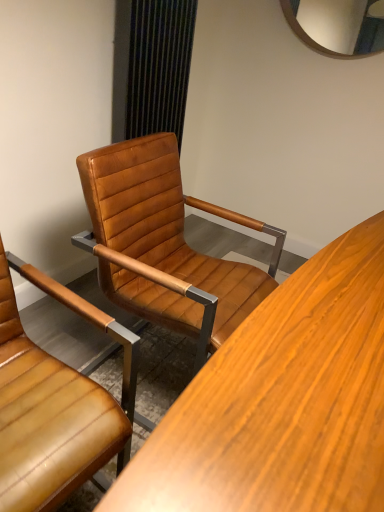
In order to face leather at center, the second chair in the right-to-left sequence, should I rotate leftwards or rightwards?

Turn left by 23.355 degrees to look at leather at center, the second chair in the right-to-left sequence.

Locate an element on the screen. The image size is (384, 512). leather at center, the first chair from the left is located at coordinates pyautogui.click(x=55, y=404).

From the image's perspective, is black textured curtain at upper center located above or below leather at center, the second chair in the right-to-left sequence?

Based on their image positions, black textured curtain at upper center is located above leather at center, the second chair in the right-to-left sequence.

Between point (137, 13) and point (4, 397), which one is positioned behind?

Point (137, 13)

From a real-world perspective, is black textured curtain at upper center on top of leather at center, the first chair from the left?

Indeed, from a real-world perspective, black textured curtain at upper center stands above leather at center, the first chair from the left.

Who is bigger, black textured curtain at upper center or leather at center, the second chair in the right-to-left sequence?

With larger size is leather at center, the second chair in the right-to-left sequence.

From a real-world perspective, does black textured curtain at upper center stand above leather at center, which ranks as the 1th chair in right-to-left order?

Yes.

Considering the relative sizes of black textured curtain at upper center and leather at center, which ranks as the 1th chair in right-to-left order, in the image provided, is black textured curtain at upper center smaller than leather at center, which ranks as the 1th chair in right-to-left order,?

Yes.

Is black textured curtain at upper center looking in the opposite direction of leather at center, which ranks as the 1th chair in right-to-left order?

black textured curtain at upper center does not have its back to leather at center, which ranks as the 1th chair in right-to-left order.

Is black textured curtain at upper center completely or partially outside of leather at center, which ranks as the 1th chair in right-to-left order?

Yes, black textured curtain at upper center is located beyond the bounds of leather at center, which ranks as the 1th chair in right-to-left order.

Considering the sizes of objects leather at center, which ranks as the 1th chair in right-to-left order, and leather at center, the first chair from the left, in the image provided, who is shorter, leather at center, which ranks as the 1th chair in right-to-left order, or leather at center, the first chair from the left,?

With less height is leather at center, the first chair from the left.

Is leather at center, which ranks as the 1th chair in right-to-left order, smaller than leather at center, the second chair in the right-to-left sequence?

No, leather at center, which ranks as the 1th chair in right-to-left order, is not smaller than leather at center, the second chair in the right-to-left sequence.

From the image's perspective, does leather at center, which ranks as the 1th chair in right-to-left order, appear lower than leather at center, the first chair from the left?

No, from the image's perspective, leather at center, which ranks as the 1th chair in right-to-left order, is not below leather at center, the first chair from the left.

Considering the sizes of leather at center, the second chair in the right-to-left sequence, and leather at center, which ranks as the second chair in left-to-right order, in the image, is leather at center, the second chair in the right-to-left sequence, wider or thinner than leather at center, which ranks as the second chair in left-to-right order,?

Considering their sizes, leather at center, the second chair in the right-to-left sequence, looks slimmer than leather at center, which ranks as the second chair in left-to-right order.

Would you consider leather at center, the first chair from the left, to be distant from leather at center, which ranks as the 1th chair in right-to-left order?

leather at center, the first chair from the left, is near leather at center, which ranks as the 1th chair in right-to-left order, not far away.

Does leather at center, the first chair from the left, have a larger size compared to leather at center, which ranks as the 1th chair in right-to-left order?

No.

How many degrees apart are the facing directions of leather at center, the second chair in the right-to-left sequence, and leather at center, which ranks as the second chair in left-to-right order?

leather at center, the second chair in the right-to-left sequence, and leather at center, which ranks as the second chair in left-to-right order, are facing 4.02 degrees away from each other.

Considering the relative sizes of leather at center, the first chair from the left, and black textured curtain at upper center in the image provided, is leather at center, the first chair from the left, smaller than black textured curtain at upper center?

Actually, leather at center, the first chair from the left, might be larger than black textured curtain at upper center.

Can you confirm if leather at center, the second chair in the right-to-left sequence, is taller than black textured curtain at upper center?

In fact, leather at center, the second chair in the right-to-left sequence, may be shorter than black textured curtain at upper center.

Is black textured curtain at upper center located within leather at center, the second chair in the right-to-left sequence?

No, black textured curtain at upper center is located outside of leather at center, the second chair in the right-to-left sequence.

Is leather at center, which ranks as the 1th chair in right-to-left order, spatially inside black textured curtain at upper center, or outside of it?

leather at center, which ranks as the 1th chair in right-to-left order, is located beyond the bounds of black textured curtain at upper center.

What's the angular difference between leather at center, which ranks as the 1th chair in right-to-left order, and black textured curtain at upper center's facing directions?

The angular difference between leather at center, which ranks as the 1th chair in right-to-left order, and black textured curtain at upper center is 0.741 degrees.

Measure the distance between leather at center, which ranks as the second chair in left-to-right order, and black textured curtain at upper center.

They are 72.08 centimeters apart.

Where is `curtain on the left of the leather at center, which ranks as the second chair in left-to-right order`? Image resolution: width=384 pixels, height=512 pixels. curtain on the left of the leather at center, which ranks as the second chair in left-to-right order is located at coordinates (158, 66).

At what (x,y) coordinates should I click in order to perform the action: click on curtain above the leather at center, the second chair in the right-to-left sequence (from a real-world perspective). Please return your answer as a coordinate pair (x, y). This screenshot has height=512, width=384. Looking at the image, I should click on (158, 66).

The height and width of the screenshot is (512, 384). I want to click on curtain on the left side of leather at center, which ranks as the second chair in left-to-right order, so click(x=158, y=66).

Looking at this image, based on their spatial positions, is leather at center, which ranks as the 1th chair in right-to-left order, or leather at center, the first chair from the left, closer to black textured curtain at upper center?

leather at center, which ranks as the 1th chair in right-to-left order.

When comparing their distances from black textured curtain at upper center, does leather at center, the first chair from the left, or leather at center, which ranks as the second chair in left-to-right order, seem closer?

leather at center, which ranks as the second chair in left-to-right order.

Looking at the image, which one is located further to leather at center, the first chair from the left, leather at center, which ranks as the second chair in left-to-right order, or black textured curtain at upper center?

black textured curtain at upper center is further to leather at center, the first chair from the left.

Estimate the real-world distances between objects in this image. Which object is further from leather at center, the second chair in the right-to-left sequence, black textured curtain at upper center or leather at center, which ranks as the 1th chair in right-to-left order?

Based on the image, black textured curtain at upper center appears to be further to leather at center, the second chair in the right-to-left sequence.

Looking at this image, which object lies nearer to the anchor point leather at center, which ranks as the second chair in left-to-right order, leather at center, the first chair from the left, or black textured curtain at upper center?

The object closer to leather at center, which ranks as the second chair in left-to-right order, is leather at center, the first chair from the left.

When comparing their distances from leather at center, which ranks as the 1th chair in right-to-left order, does black textured curtain at upper center or leather at center, the first chair from the left, seem further?

black textured curtain at upper center lies further to leather at center, which ranks as the 1th chair in right-to-left order, than the other object.

Identify the location of chair between black textured curtain at upper center and leather at center, the first chair from the left, in the vertical direction. The image size is (384, 512). (164, 244).